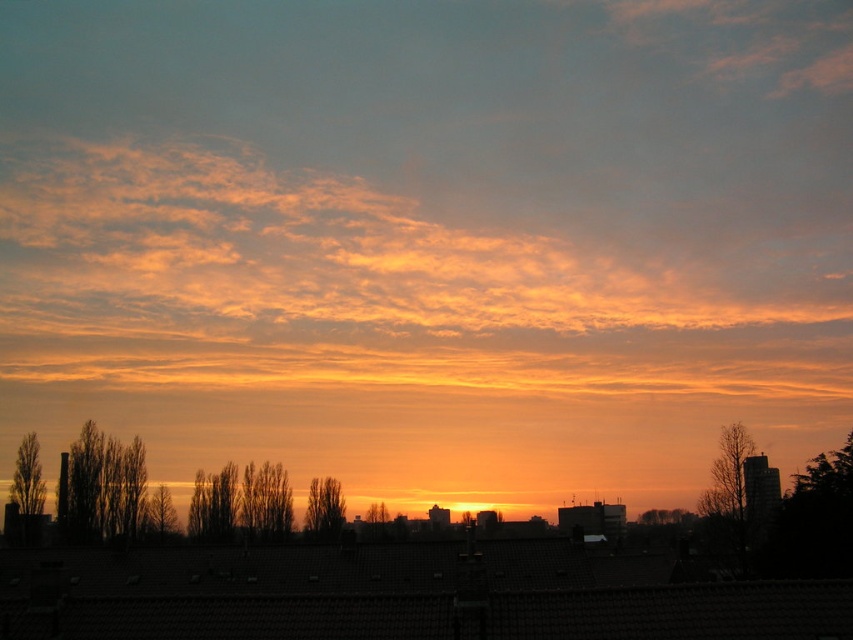
Question: Is smooth brown tree at center smaller than brown matte tree at left?

Choices:
 (A) no
 (B) yes

Answer: (A)

Question: Is smooth brown tree at center behind green matte tree at center?

Choices:
 (A) yes
 (B) no

Answer: (B)

Question: Which point is farther to the camera?

Choices:
 (A) green matte tree at center
 (B) smooth brown tree at center
 (C) bare branches at right
 (D) brown matte tree at left

Answer: (A)

Question: Which object appears closest to the camera in this image?

Choices:
 (A) bare branches at right
 (B) brown matte tree at left
 (C) smooth brown tree at center
 (D) green matte tree at center

Answer: (A)

Question: Which point appears closest to the camera in this image?

Choices:
 (A) (314, 508)
 (B) (643, 515)

Answer: (A)

Question: Does bare branches at right appear on the left side of smooth brown tree at center?

Choices:
 (A) yes
 (B) no

Answer: (B)